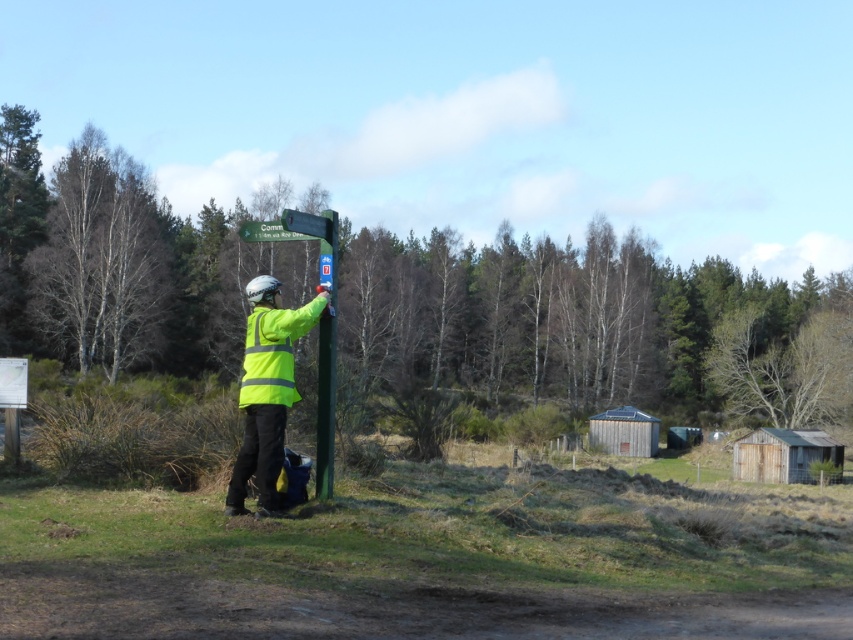
Question: Can you confirm if high-visibility yellow jacket at center is wider than green painted wood at center?

Choices:
 (A) yes
 (B) no

Answer: (A)

Question: Among these points, which one is farthest from the camera?

Choices:
 (A) (73, 196)
 (B) (256, 282)

Answer: (A)

Question: Which of these objects is positioned closest to the high-visibility fabric safety vest at center?

Choices:
 (A) green plastic sign at upper center
 (B) green painted wood at center
 (C) green leafy tree at center

Answer: (B)

Question: Can you confirm if bare wood tree at left is positioned to the right of high-visibility yellow jacket at center?

Choices:
 (A) no
 (B) yes

Answer: (A)

Question: Which object is farther from the camera taking this photo?

Choices:
 (A) green painted wood at center
 (B) bare wood tree at left
 (C) green leafy tree at center
 (D) high-visibility fabric safety vest at center

Answer: (B)

Question: Is bare wood tree at left thinner than green plastic sign at upper center?

Choices:
 (A) yes
 (B) no

Answer: (B)